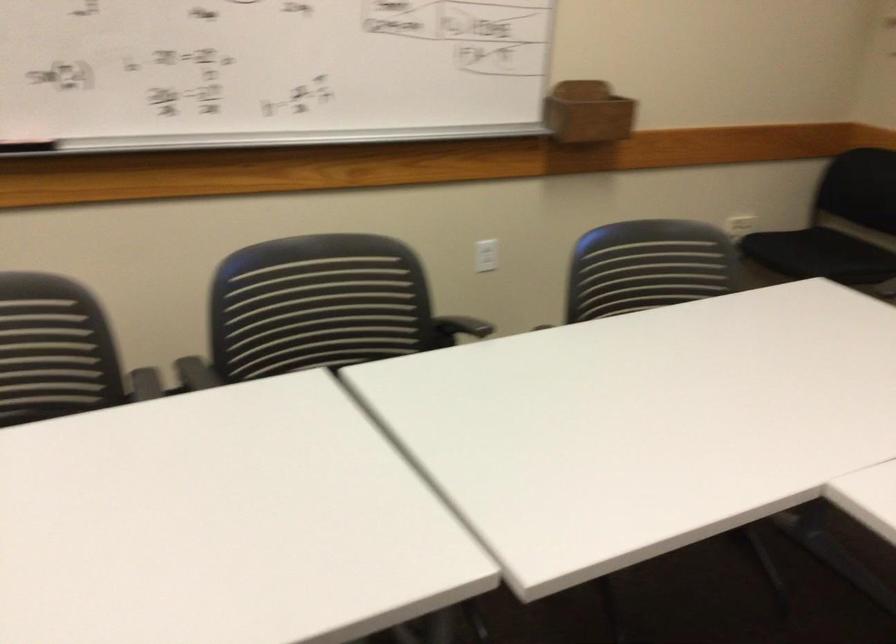
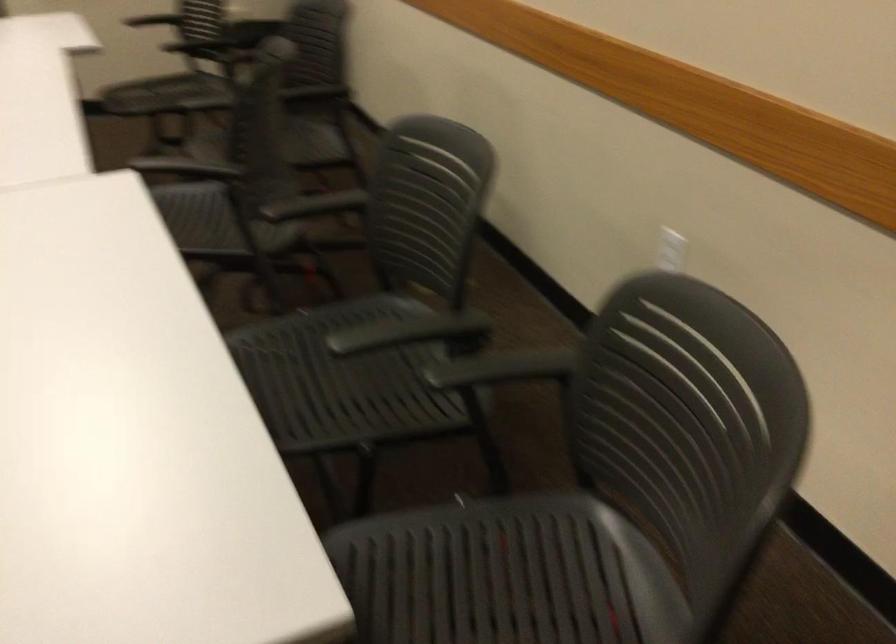
Which direction would the cameraman need to move to produce the second image?

The cameraman walked toward right, backward.